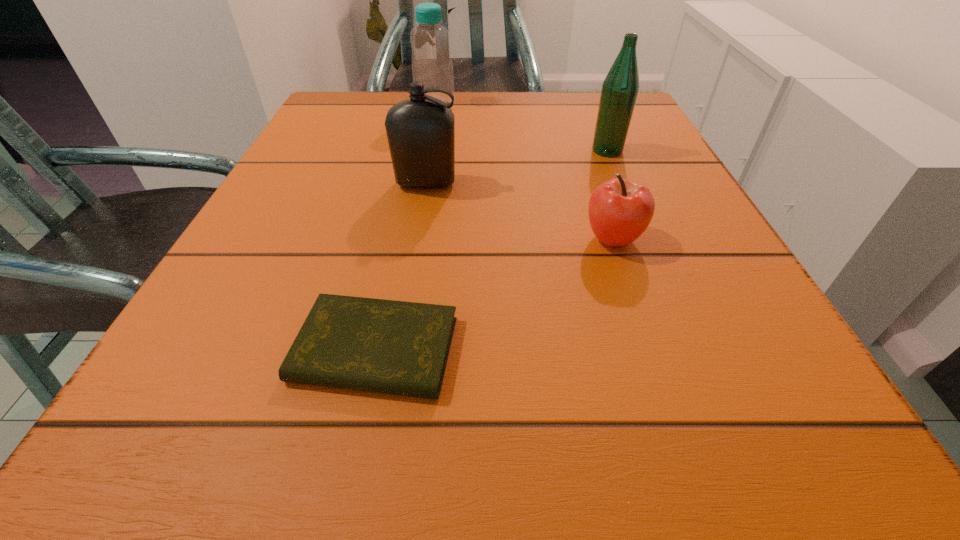
Locate an element on the screen. the second nearest bottle is located at coordinates (620, 88).

At what (x,y) coordinates should I click in order to perform the action: click on the rightmost bottle. Please return your answer as a coordinate pair (x, y). This screenshot has height=540, width=960. Looking at the image, I should click on (620, 88).

At what (x,y) coordinates should I click in order to perform the action: click on the farthest object. Please return your answer as a coordinate pair (x, y). The width and height of the screenshot is (960, 540). Looking at the image, I should click on (432, 65).

This screenshot has width=960, height=540. I want to click on the third farthest object, so click(x=421, y=130).

Identify the location of the nearest bottle. (421, 130).

I want to click on the second shortest object, so click(620, 210).

Image resolution: width=960 pixels, height=540 pixels. Identify the location of the second nearest object. (620, 210).

Identify the location of diary. Image resolution: width=960 pixels, height=540 pixels. (395, 347).

Where is `the nearest object`? the nearest object is located at coordinates (395, 347).

Locate an element on the screen. The image size is (960, 540). free spot located on the left of the rightmost bottle is located at coordinates (544, 151).